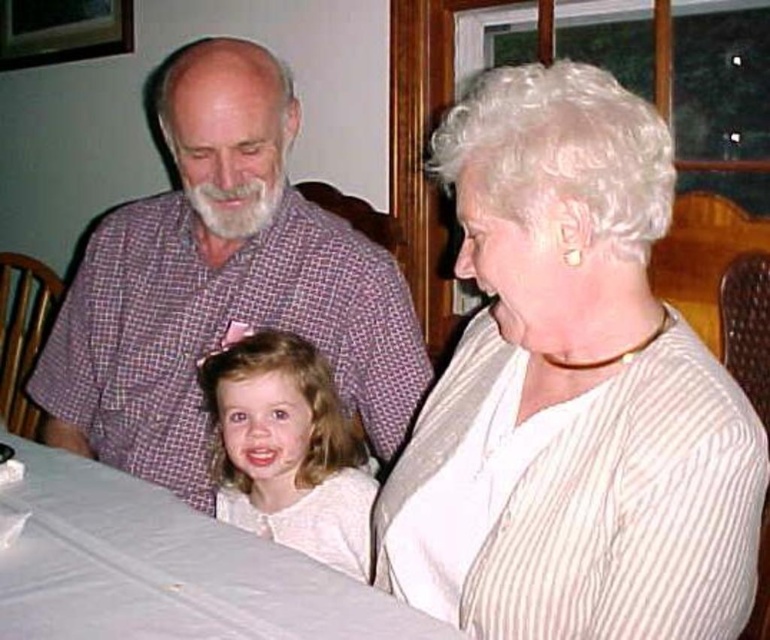
Question: Based on their relative distances, which object is farther from the blonde hair at center?

Choices:
 (A) purple checkered shirt at upper left
 (B) white plastic table at lower left

Answer: (B)

Question: Which point is farther to the camera?

Choices:
 (A) white plastic table at lower left
 (B) blonde hair at center
 (C) white striped blouse at upper right
 (D) purple checkered shirt at upper left

Answer: (D)

Question: Which of the following is the farthest from the observer?

Choices:
 (A) white plastic table at lower left
 (B) blonde hair at center
 (C) purple checkered shirt at upper left

Answer: (C)

Question: Observing the image, what is the correct spatial positioning of white striped blouse at upper right in reference to white plastic table at lower left?

Choices:
 (A) below
 (B) above

Answer: (B)

Question: Observing the image, what is the correct spatial positioning of white striped blouse at upper right in reference to white plastic table at lower left?

Choices:
 (A) right
 (B) left

Answer: (A)

Question: Is purple checkered shirt at upper left positioned at the back of blonde hair at center?

Choices:
 (A) no
 (B) yes

Answer: (B)